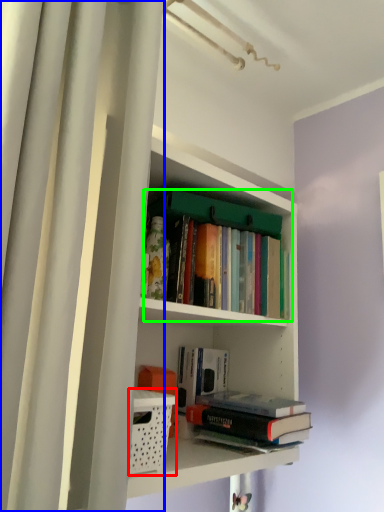
Question: Considering the real-world distances, which object is closest to basket (highlighted by a red box)? shower curtain (highlighted by a blue box) or book (highlighted by a green box).

Choices:
 (A) shower curtain
 (B) book

Answer: (A)